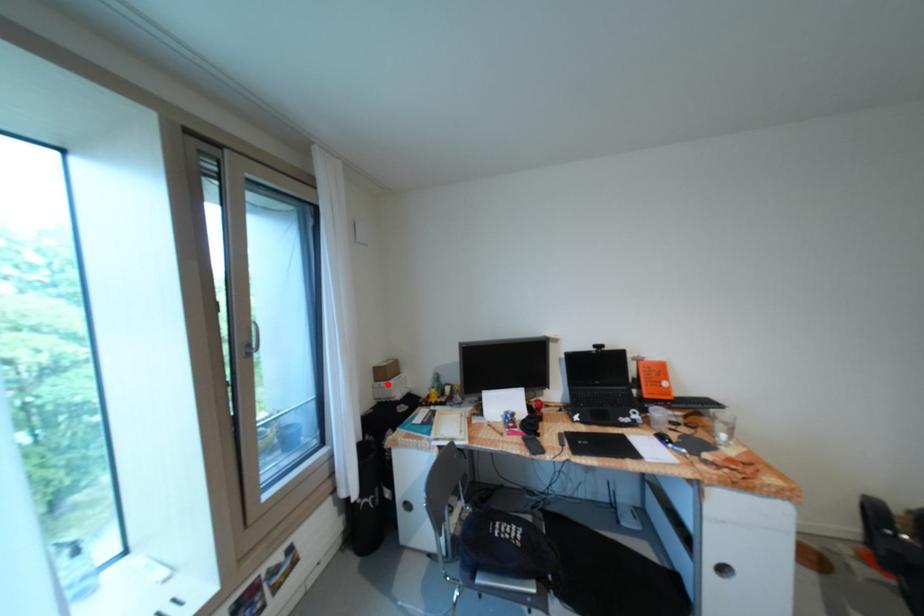
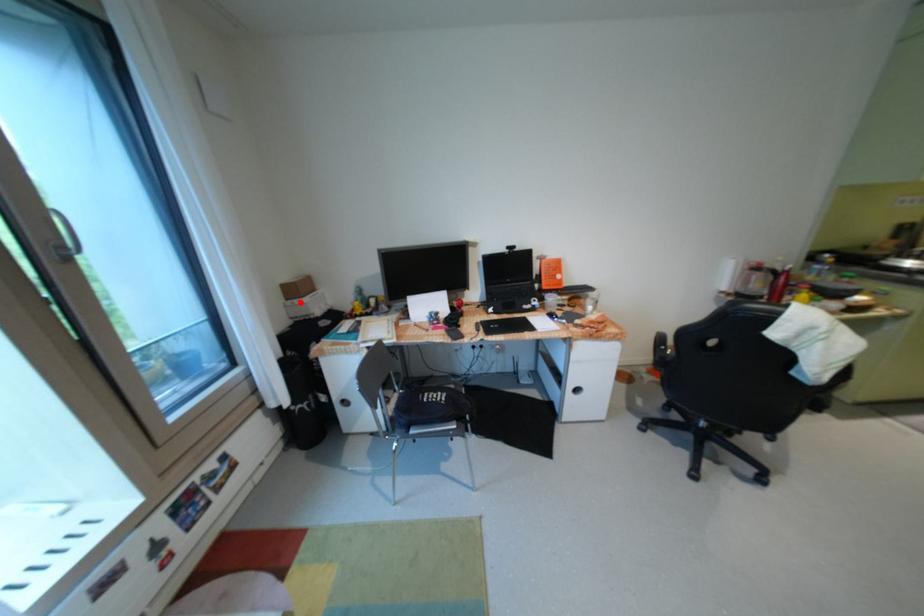
I am providing you with two images of the same scene from different viewpoints. A red point is marked on the first image and another point is marked on the second image. Does the point marked in image1 correspond to the same location as the one in image2?

Yes